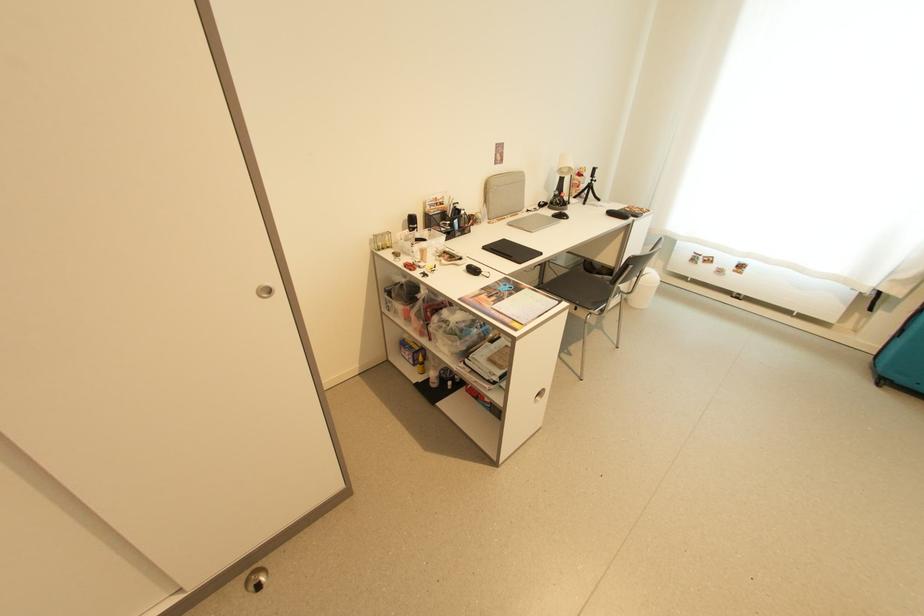
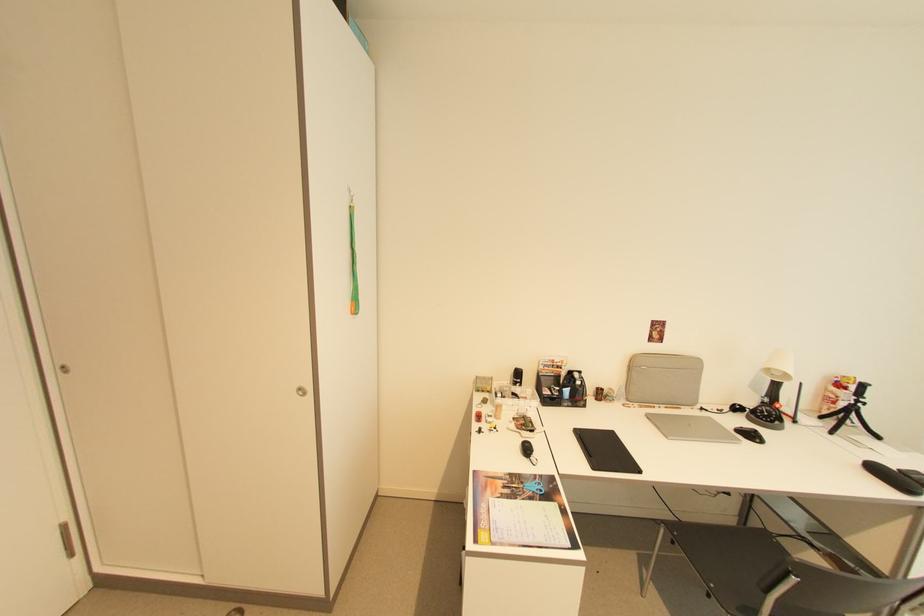
Find the pixel in the second image that matches (570,219) in the first image.

(762, 442)